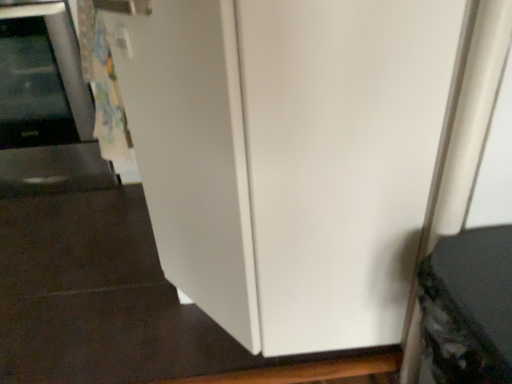
Question: Based on their sizes in the image, would you say satin silver microwave at left, the second appliance ordered from the bottom, is bigger or smaller than textured gray fabric at lower right, arranged as the first appliance when viewed from the front?

Choices:
 (A) big
 (B) small

Answer: (A)

Question: Which is correct: satin silver microwave at left, the 1th appliance from the left, is inside textured gray fabric at lower right, positioned as the second appliance in back-to-front order, or outside of it?

Choices:
 (A) inside
 (B) outside

Answer: (B)

Question: From a real-world perspective, is satin silver microwave at left, acting as the first appliance starting from the top, above or below textured gray fabric at lower right, arranged as the first appliance when viewed from the front?

Choices:
 (A) below
 (B) above

Answer: (B)

Question: In the image, is textured gray fabric at lower right, which is the first appliance from bottom to top, on the left side or the right side of satin silver microwave at left, which is the 2th appliance in right-to-left order?

Choices:
 (A) left
 (B) right

Answer: (B)

Question: From a real-world perspective, relative to satin silver microwave at left, which is counted as the first appliance, starting from the back, is textured gray fabric at lower right, which is the first appliance from bottom to top, vertically above or below?

Choices:
 (A) below
 (B) above

Answer: (A)

Question: Considering the positions of textured gray fabric at lower right, which ranks as the second appliance in top-to-bottom order, and satin silver microwave at left, acting as the first appliance starting from the top, in the image, is textured gray fabric at lower right, which ranks as the second appliance in top-to-bottom order, wider or thinner than satin silver microwave at left, acting as the first appliance starting from the top,?

Choices:
 (A) thin
 (B) wide

Answer: (A)

Question: Is point (499, 354) closer or farther from the camera than point (50, 187)?

Choices:
 (A) closer
 (B) farther

Answer: (A)